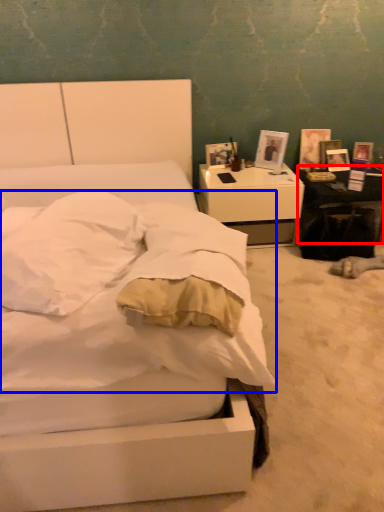
Question: Which object is further to the camera taking this photo, table (highlighted by a red box) or mattress (highlighted by a blue box)?

Choices:
 (A) table
 (B) mattress

Answer: (A)